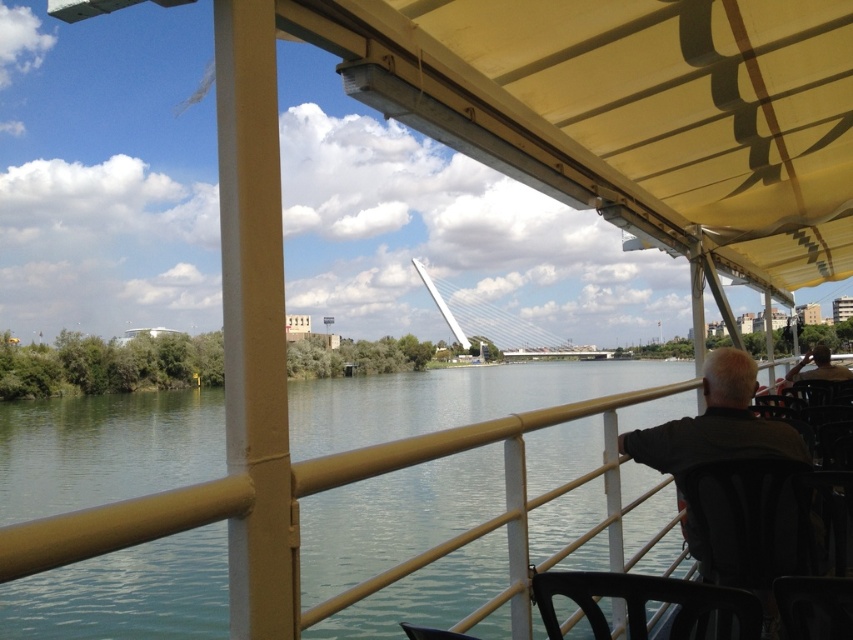
You are on a boat deck and want to sit down. There is a black plastic chair at lower center and greenish water at center. Which object is closer to you?

The black plastic chair at lower center is behind greenish water at center, so the greenish water at center is closer to you.

You are a passenger on the boat and want to place your dark gray fabric jacket at right on the black plastic chair at lower center. Can you do this without moving the chair?

The dark gray fabric jacket at right is located below the black plastic chair at lower center, so you can place the jacket on the chair without needing to move it.